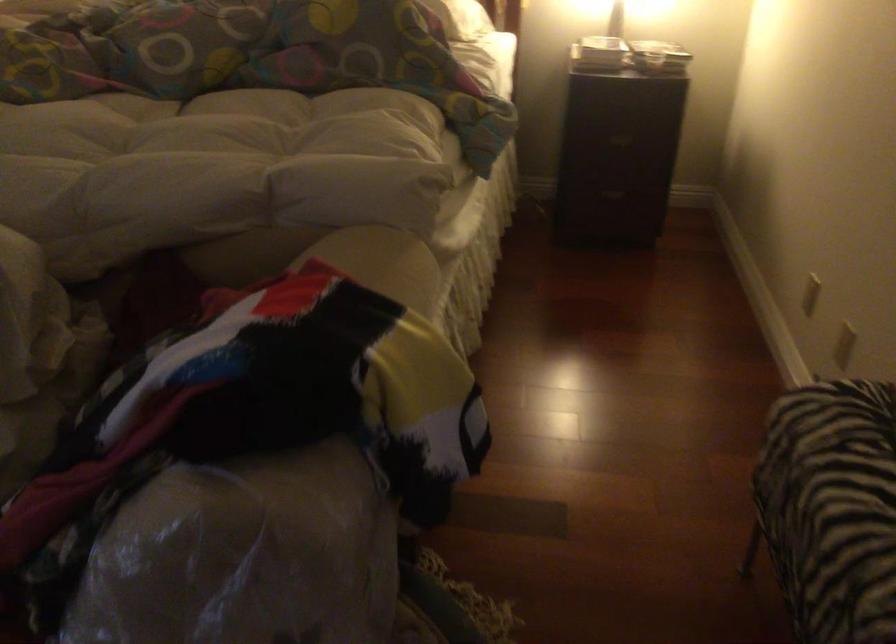
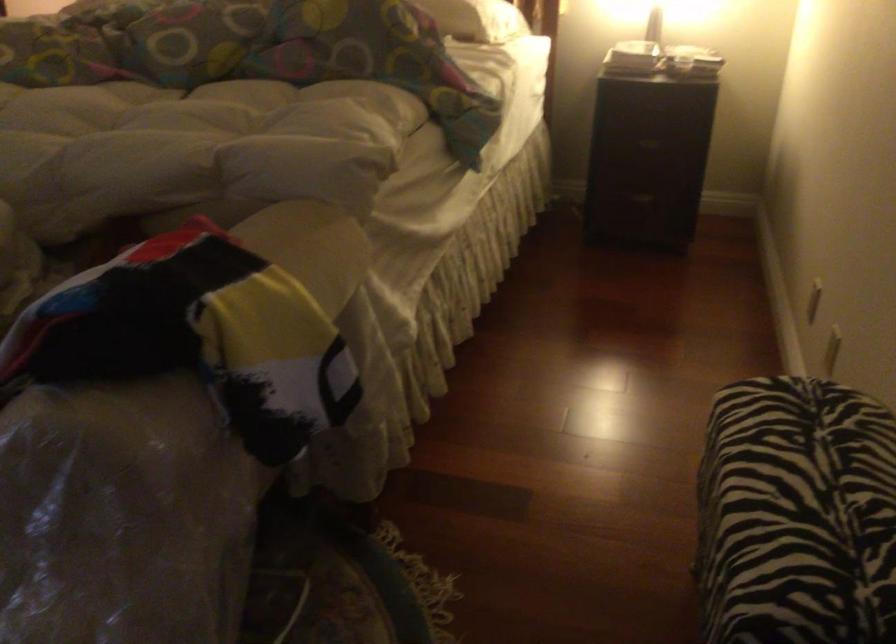
Where in the second image is the point corresponding to the point at 813,290 from the first image?

(814, 301)